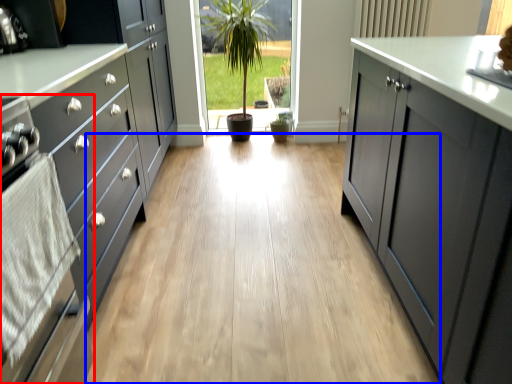
Question: Which point is further to the camera, oven (highlighted by a red box) or plain (highlighted by a blue box)?

Choices:
 (A) oven
 (B) plain

Answer: (B)